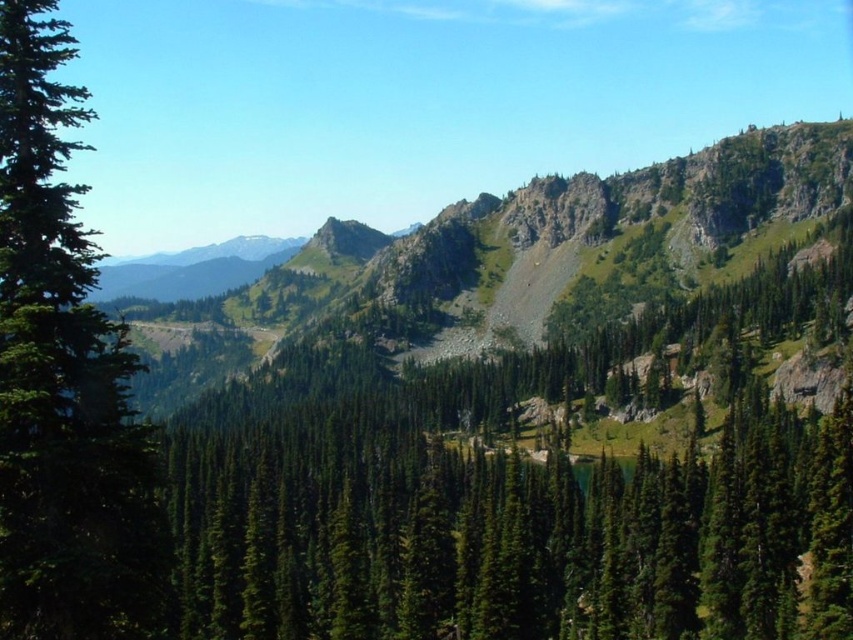
Who is shorter, green rocky mountain at center or green matte tree at left?

Standing shorter between the two is green matte tree at left.

Between green rocky mountain at center and green matte tree at left, which one has more height?

With more height is green rocky mountain at center.

Between point (711, 205) and point (16, 33), which one is positioned in front?

Point (16, 33)

This screenshot has height=640, width=853. I want to click on green rocky mountain at center, so click(x=509, y=262).